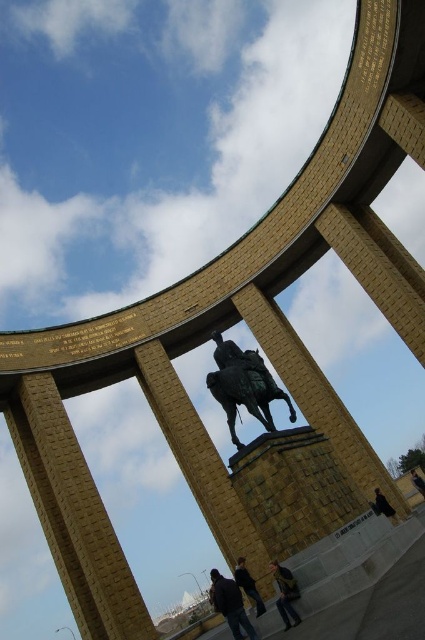
Does denim jacket at lower center lie behind dark blue jacket at center?

No, it is not.

Can you confirm if denim jacket at lower center is wider than dark blue jacket at center?

Incorrect, denim jacket at lower center's width does not surpass dark blue jacket at center's.

What do you see at coordinates (286, 593) in the screenshot? I see `denim jacket at lower center` at bounding box center [286, 593].

Where is `denim jacket at lower center`? denim jacket at lower center is located at coordinates (286, 593).

Does shiny bronze horse at center appear over dark blue jeans at lower center?

Correct, shiny bronze horse at center is located above dark blue jeans at lower center.

Looking at this image, is shiny bronze horse at center bigger than dark blue jeans at lower center?

No.

The image size is (425, 640). I want to click on shiny bronze horse at center, so 243,385.

Between dark blue jeans at lower center and dark blue jacket at center, which one has less height?

dark blue jacket at center

I want to click on dark blue jeans at lower center, so click(x=229, y=604).

Between point (212, 588) and point (251, 577), which one is positioned in front?

Positioned in front is point (251, 577).

The width and height of the screenshot is (425, 640). In order to click on dark blue jeans at lower center in this screenshot , I will do `click(229, 604)`.